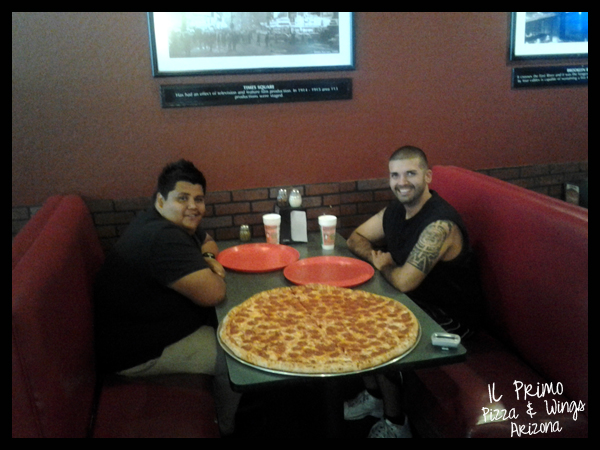
The image size is (600, 450). Find the location of `textured wall`. textured wall is located at coordinates pos(123,126).